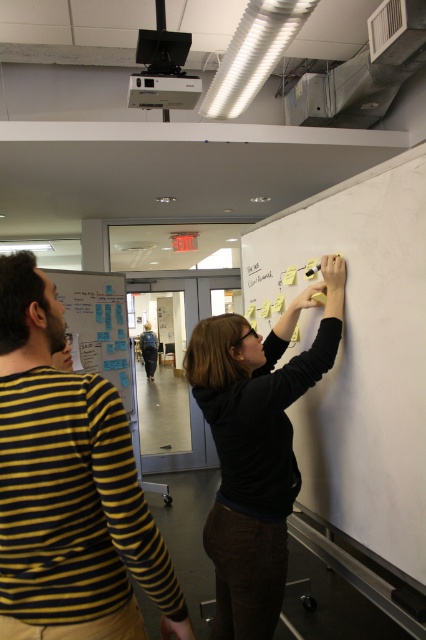
Between point (337, 524) and point (285, 496), which one is positioned in front?

Point (285, 496)

In the scene shown: Between white matte whiteboard at upper right and black matte shirt at upper right, which one has less height?

With less height is white matte whiteboard at upper right.

Identify the location of white matte whiteboard at upper right. (359, 352).

Does yellow striped shirt at left have a greater height compared to white paperboard at left?

No, yellow striped shirt at left is not taller than white paperboard at left.

Consider the image. Which of these two, yellow striped shirt at left or white paperboard at left, stands taller?

white paperboard at left

Identify the location of yellow striped shirt at left. This screenshot has width=426, height=640. (69, 486).

Find the location of `yellow striped shirt at left`. yellow striped shirt at left is located at coordinates (69, 486).

Which is more to the right, white matte whiteboard at upper right or white paperboard at left?

From the viewer's perspective, white matte whiteboard at upper right appears more on the right side.

Is white matte whiteboard at upper right closer to the viewer compared to white paperboard at left?

Yes, white matte whiteboard at upper right is in front of white paperboard at left.

The height and width of the screenshot is (640, 426). Identify the location of white matte whiteboard at upper right. (359, 352).